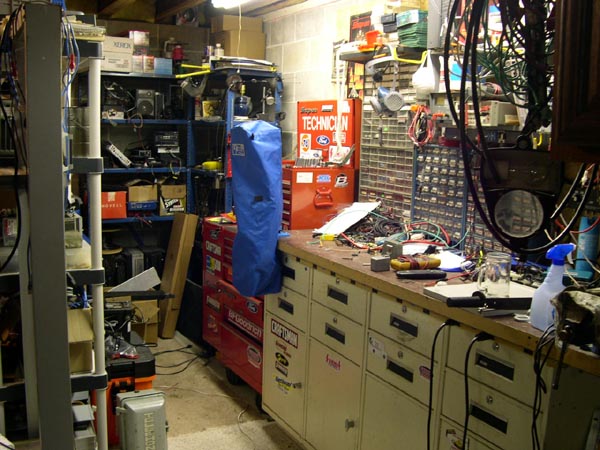
The width and height of the screenshot is (600, 450). Find the location of `glass jar`. glass jar is located at coordinates (492, 281).